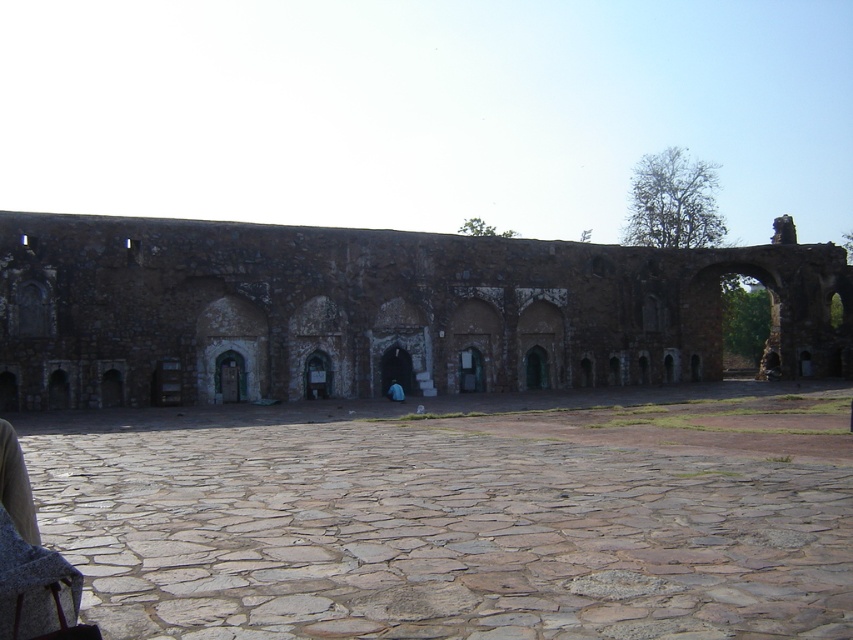
Question: Does stone paved courtyard at center appear over rustic stone wall at center?

Choices:
 (A) yes
 (B) no

Answer: (B)

Question: Does stone paved courtyard at center come behind rustic stone wall at center?

Choices:
 (A) yes
 (B) no

Answer: (B)

Question: Does stone paved courtyard at center have a larger size compared to rustic stone wall at center?

Choices:
 (A) yes
 (B) no

Answer: (B)

Question: Which object is closer to the camera taking this photo?

Choices:
 (A) stone paved courtyard at center
 (B) rustic stone wall at center

Answer: (A)

Question: Among these points, which one is farthest from the camera?

Choices:
 (A) (341, 474)
 (B) (778, 317)

Answer: (B)

Question: Which of the following is the closest to the observer?

Choices:
 (A) rustic stone wall at center
 (B) stone paved courtyard at center

Answer: (B)